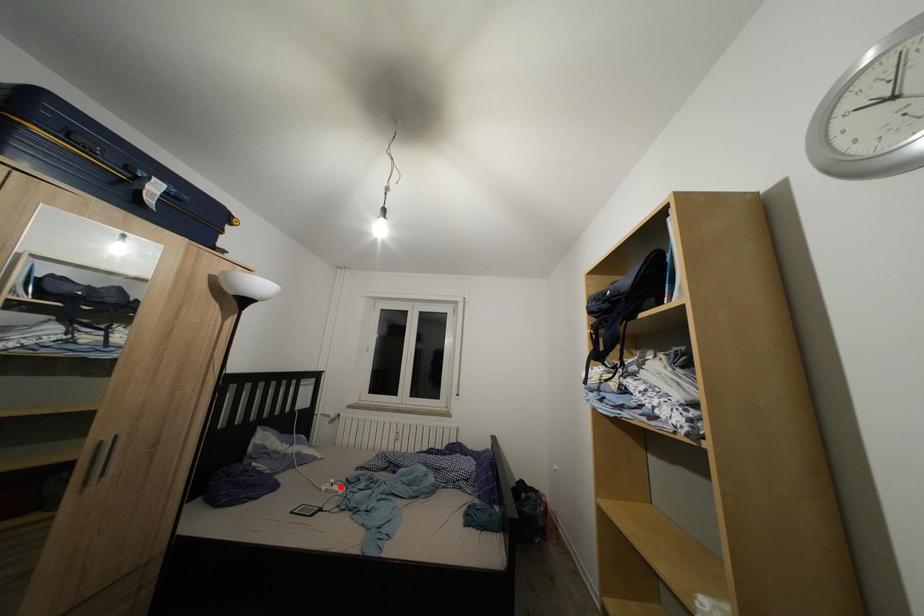
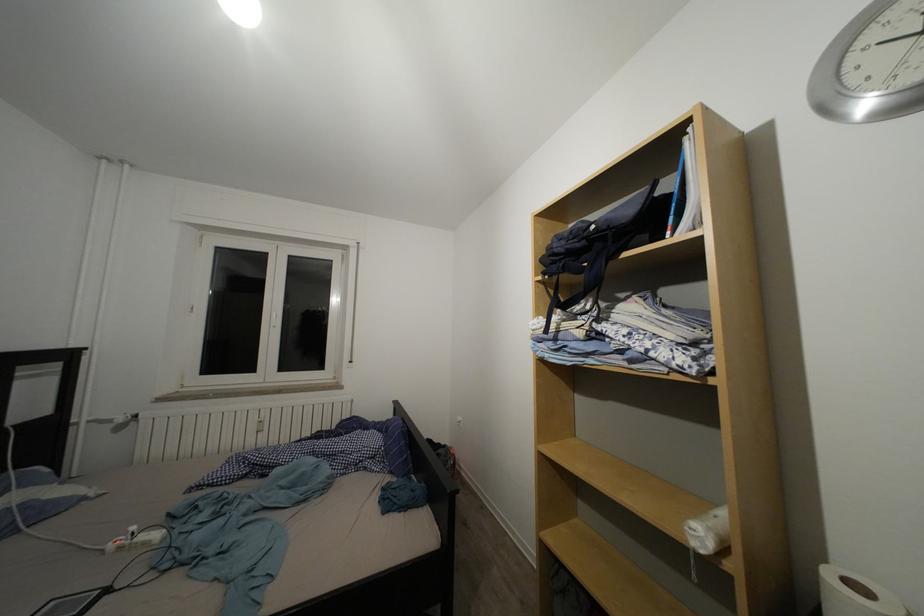
Question: I am providing you with two images of the same scene from different viewpoints. In image1, a red point is highlighted. Considering the same 3D point in image2, which of the following is correct?

Choices:
 (A) It is closer
 (B) It is farther

Answer: (A)